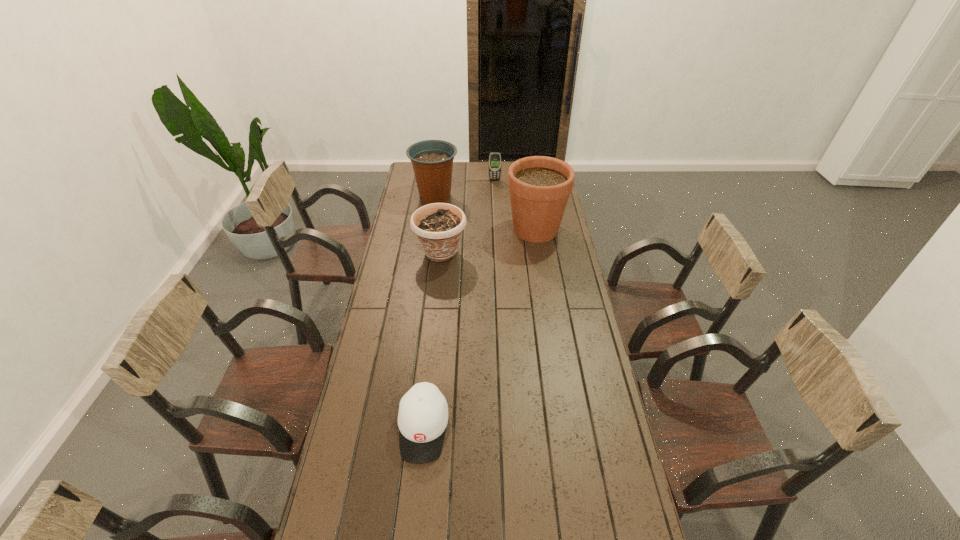
Image resolution: width=960 pixels, height=540 pixels. I want to click on the tallest object, so click(539, 186).

Where is `the rightmost object`? the rightmost object is located at coordinates (539, 186).

Find the location of a particular element. This screenshot has height=540, width=960. the second shortest flowerpot is located at coordinates (432, 160).

This screenshot has width=960, height=540. I want to click on the second tallest object, so click(x=432, y=160).

Locate an element on the screen. The image size is (960, 540). the third tallest object is located at coordinates (438, 226).

The width and height of the screenshot is (960, 540). I want to click on the farthest object, so click(495, 157).

This screenshot has width=960, height=540. In order to click on cellular telephone in this screenshot , I will do `click(495, 157)`.

Locate an element on the screen. The image size is (960, 540). the shortest object is located at coordinates (423, 411).

This screenshot has height=540, width=960. In order to click on the nearest object in this screenshot , I will do `click(423, 411)`.

This screenshot has height=540, width=960. What are the coordinates of `vacant area located 0.110m on the back of the rightmost object` in the screenshot? It's located at (531, 201).